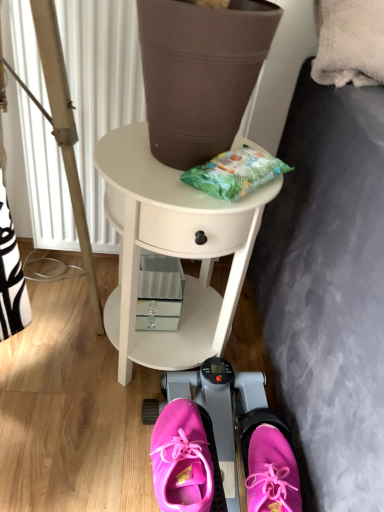
Where is `free space to the left of pink fabric sneakers at center`? Image resolution: width=384 pixels, height=512 pixels. free space to the left of pink fabric sneakers at center is located at coordinates (91, 438).